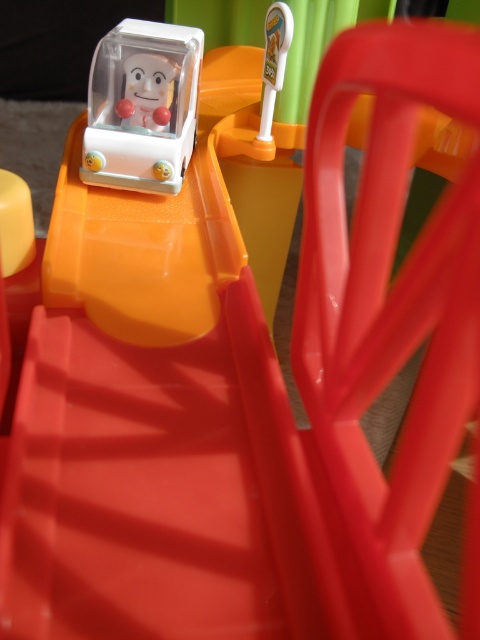
Between matte white toy car at upper left and matte plastic doll at upper center, which one is positioned higher?

Positioned higher is matte plastic doll at upper center.

This screenshot has height=640, width=480. What do you see at coordinates (142, 106) in the screenshot? I see `matte white toy car at upper left` at bounding box center [142, 106].

Is point (154, 147) farther from viewer compared to point (130, 84)?

No, it is in front of (130, 84).

Identify the location of matte white toy car at upper left. (142, 106).